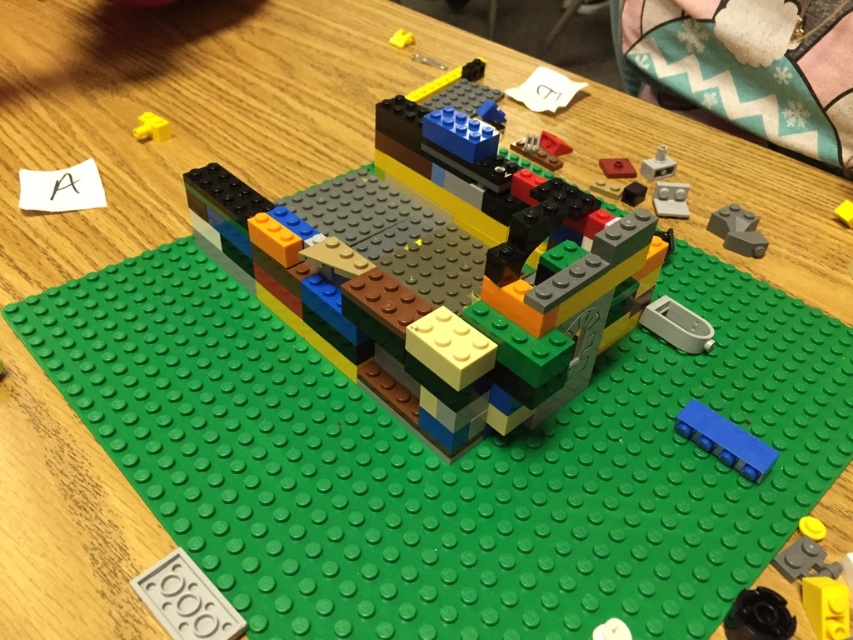
Question: Is blue plastic brick at lower right in front of matte yellow brick at upper left?

Choices:
 (A) no
 (B) yes

Answer: (B)

Question: Is multicolored plastic bricks at center to the left of clear plastic lever at upper right from the viewer's perspective?

Choices:
 (A) no
 (B) yes

Answer: (B)

Question: Which point is closer to the camera taking this photo?

Choices:
 (A) (654, 163)
 (B) (326, 202)
 (C) (167, 132)
 (D) (746, 243)

Answer: (D)

Question: Can you confirm if multicolored plastic bricks at center is smaller than blue plastic brick at lower right?

Choices:
 (A) no
 (B) yes

Answer: (A)

Question: Which point appears closest to the camera in this image?

Choices:
 (A) (656, 186)
 (B) (747, 248)

Answer: (B)

Question: Which object is the closest to the matte red brick at center?

Choices:
 (A) multicolored plastic bricks at center
 (B) clear plastic lever at upper right
 (C) blue plastic brick at lower right

Answer: (B)